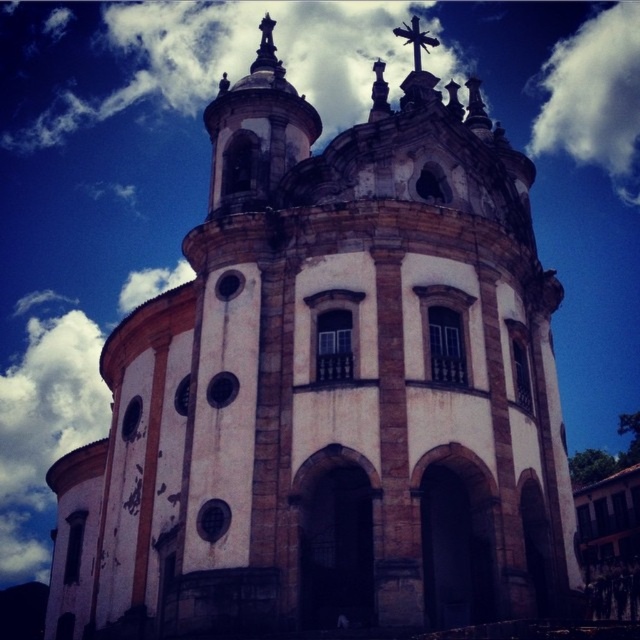
Consider the image. You are an architect analyzing the church facade. You notice the white fluffy cloud at upper right and the metallic cross at upper center. Which object is positioned higher in the sky?

The white fluffy cloud at upper right is located above the metallic cross at upper center, so it is positioned higher in the sky.

You are an architect examining the church facade. From your vantage point, which object is closer to you between the metallic cross at upper center and the white fluffy cloud at upper right?

The white fluffy cloud at upper right is closer to you because the metallic cross at upper center is behind it.

You are standing in front of the historic church and looking at the sky. There is a point marked at coordinates point (595,97). What object is located at that point?

The point (595,97) corresponds to a white fluffy cloud at upper right.